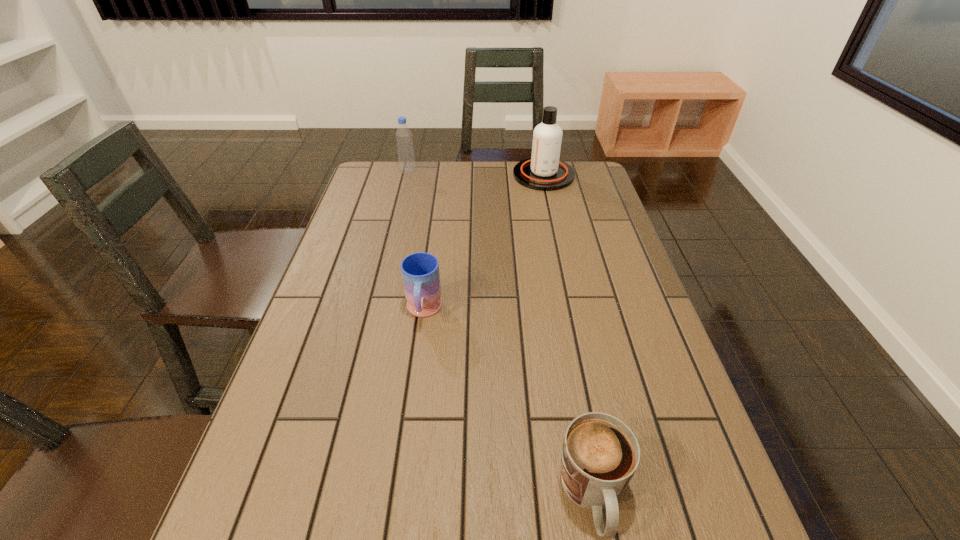
Where is `object present at the left edge`? The width and height of the screenshot is (960, 540). object present at the left edge is located at coordinates (404, 140).

At what (x,y) coordinates should I click in order to perform the action: click on object that is at the right edge. Please return your answer as a coordinate pair (x, y). The height and width of the screenshot is (540, 960). Looking at the image, I should click on (544, 171).

Locate an element on the screen. object positioned at the far left corner is located at coordinates (404, 140).

The image size is (960, 540). What are the coordinates of `object that is at the far right corner` in the screenshot? It's located at (544, 171).

In order to click on vacant region at the far edge in this screenshot , I will do `click(473, 187)`.

Identify the location of blank space at the left edge. Image resolution: width=960 pixels, height=540 pixels. (391, 218).

Where is `vacant point at the right edge`? The height and width of the screenshot is (540, 960). vacant point at the right edge is located at coordinates (693, 493).

Find the location of `free space between the bottle and the left mug`. free space between the bottle and the left mug is located at coordinates point(416,241).

Locate an element on the screen. The height and width of the screenshot is (540, 960). free space between the cleansing agent and the second tallest object is located at coordinates (476, 173).

The height and width of the screenshot is (540, 960). I want to click on unoccupied position between the bottle and the tallest object, so click(476, 173).